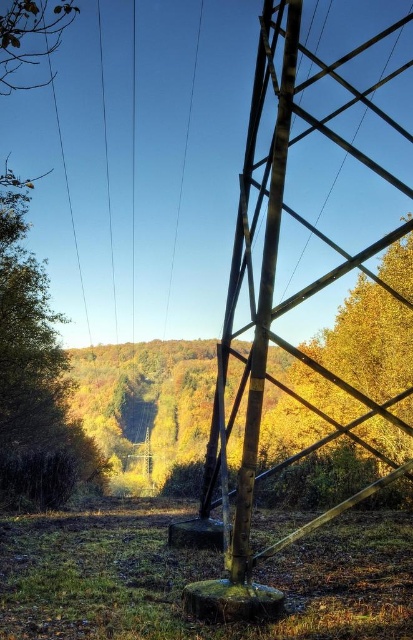
Between green mossy stump at center and green leafy tree at left, which one is positioned higher?

Positioned higher is green leafy tree at left.

Is green mossy stump at center below green leafy tree at left?

Indeed, green mossy stump at center is positioned under green leafy tree at left.

The height and width of the screenshot is (640, 413). I want to click on green mossy stump at center, so click(x=197, y=579).

This screenshot has height=640, width=413. I want to click on green mossy stump at center, so click(197, 579).

The width and height of the screenshot is (413, 640). I want to click on green mossy stump at center, so click(x=197, y=579).

Where is `green mossy stump at center`? The width and height of the screenshot is (413, 640). green mossy stump at center is located at coordinates (197, 579).

Is green mossy stump at center further to the viewer compared to smooth wire at upper center?

No, green mossy stump at center is closer to the viewer.

Who is shorter, green mossy stump at center or smooth wire at upper center?

green mossy stump at center is shorter.

I want to click on green mossy stump at center, so click(x=197, y=579).